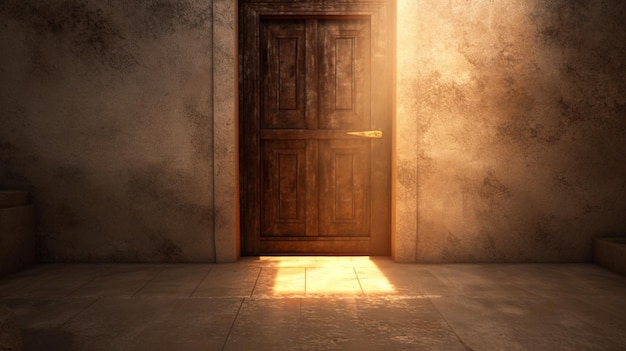
The image size is (626, 351). Identify the location of tile. (302, 317).